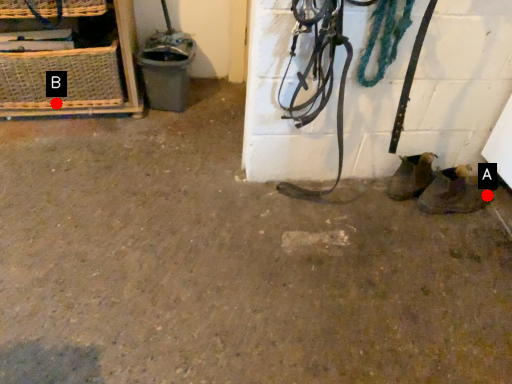
Question: Two points are circled on the image, labeled by A and B beside each circle. Which of the following is the closest to the observer?

Choices:
 (A) A is closer
 (B) B is closer

Answer: (A)